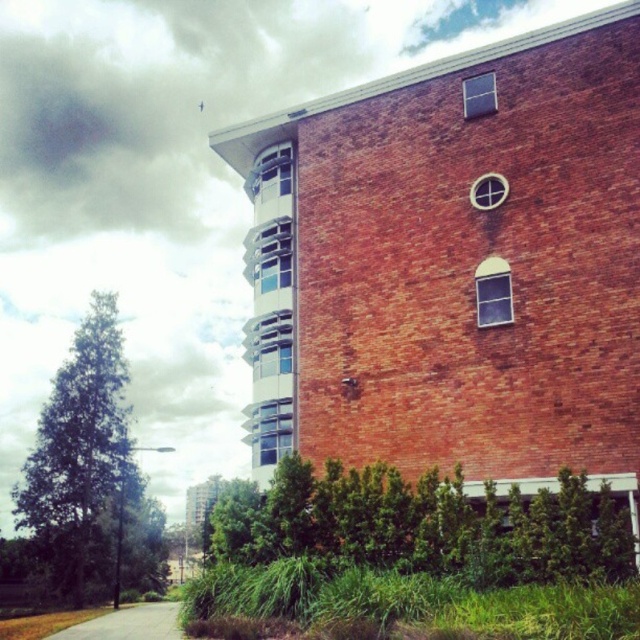
Question: Does red brick building at center appear over smooth asphalt road at lower left?

Choices:
 (A) no
 (B) yes

Answer: (B)

Question: Which of the following is the closest to the observer?

Choices:
 (A) (108, 628)
 (B) (557, 333)

Answer: (B)

Question: Is red brick building at center closer to the viewer compared to smooth asphalt road at lower left?

Choices:
 (A) yes
 (B) no

Answer: (A)

Question: Can you confirm if red brick building at center is positioned to the right of smooth asphalt road at lower left?

Choices:
 (A) yes
 (B) no

Answer: (A)